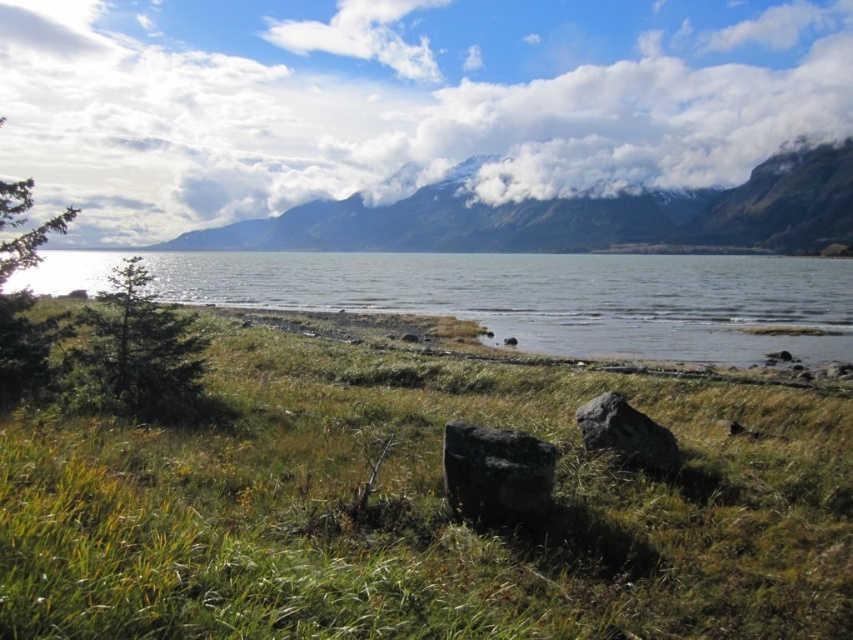
Question: Can you confirm if green grassy at lower left is thinner than gray rough rock at center?

Choices:
 (A) yes
 (B) no

Answer: (B)

Question: Which object is the farthest from the clear water at lower center?

Choices:
 (A) black rough boulder at center
 (B) snowy mountain at upper center
 (C) white fluffy cloud at upper center

Answer: (C)

Question: Is black rough boulder at center above gray rough rock at center?

Choices:
 (A) no
 (B) yes

Answer: (A)

Question: Is green grassy at lower left positioned in front of black rough boulder at center?

Choices:
 (A) yes
 (B) no

Answer: (A)

Question: Which object appears closest to the camera in this image?

Choices:
 (A) white fluffy cloud at upper center
 (B) snowy mountain at upper center
 (C) clear water at lower center
 (D) gray rough rock at center

Answer: (D)

Question: Which point is closer to the camera?

Choices:
 (A) (517, 452)
 (B) (664, 259)
 (C) (805, 188)

Answer: (A)